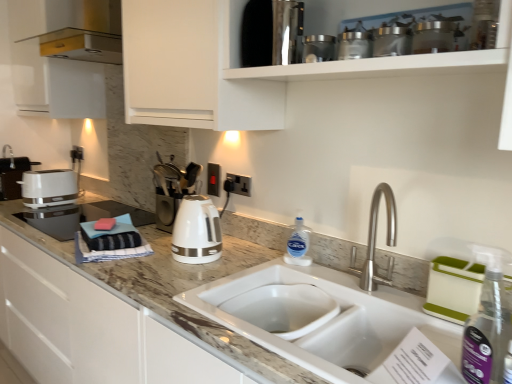
Where is `vacant space in white glossy electric kettle at center (from a real-world perspective)`? This screenshot has width=512, height=384. vacant space in white glossy electric kettle at center (from a real-world perspective) is located at coordinates (197, 263).